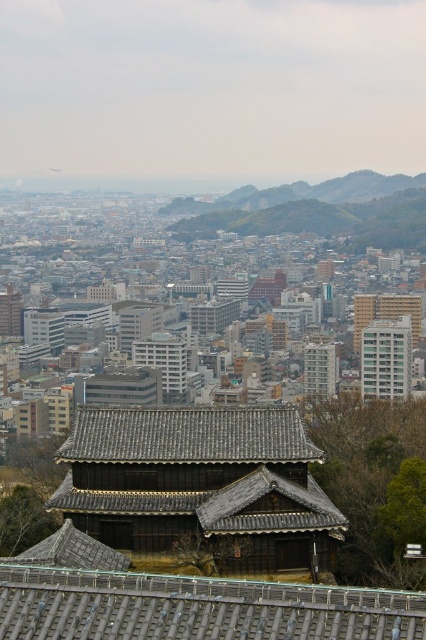
Question: Is white glossy building at upper right above wooden shingles temple at center?

Choices:
 (A) yes
 (B) no

Answer: (B)

Question: Which point is farther from the camera taking this photo?

Choices:
 (A) (152, 465)
 (B) (420, 321)

Answer: (B)

Question: Can you confirm if matte brown wooden temple at center is positioned above white glossy building at upper right?

Choices:
 (A) yes
 (B) no

Answer: (A)

Question: In this image, where is white glossy building at upper right located relative to wooden shingles temple at center?

Choices:
 (A) above
 (B) below

Answer: (B)

Question: Considering the real-world distances, which object is closest to the white glossy building at upper right?

Choices:
 (A) matte brown wooden temple at center
 (B) wooden shingles temple at center

Answer: (B)

Question: Which object is the closest to the matte brown wooden temple at center?

Choices:
 (A) white glossy building at upper right
 (B) wooden shingles temple at center

Answer: (A)